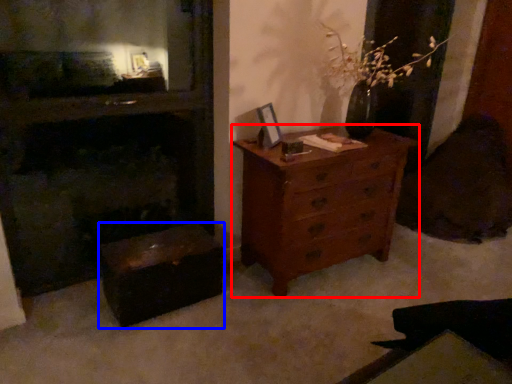
Question: Which point is closer to the camera, chest of drawers (highlighted by a red box) or vanity (highlighted by a blue box)?

Choices:
 (A) chest of drawers
 (B) vanity

Answer: (B)